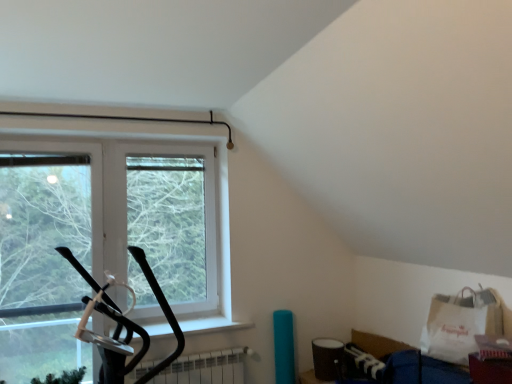
Question: From the image's perspective, is white paper grocery bag at lower right on top of white matte radiator at lower center?

Choices:
 (A) yes
 (B) no

Answer: (A)

Question: From a real-world perspective, is white paper grocery bag at lower right located higher than white matte radiator at lower center?

Choices:
 (A) yes
 (B) no

Answer: (A)

Question: Is the depth of white paper grocery bag at lower right greater than that of white matte radiator at lower center?

Choices:
 (A) yes
 (B) no

Answer: (B)

Question: Is white matte radiator at lower center a part of white paper grocery bag at lower right?

Choices:
 (A) yes
 (B) no

Answer: (B)

Question: Can you confirm if white paper grocery bag at lower right is smaller than white matte radiator at lower center?

Choices:
 (A) yes
 (B) no

Answer: (B)

Question: Does white paper grocery bag at lower right have a greater height compared to white matte radiator at lower center?

Choices:
 (A) no
 (B) yes

Answer: (B)

Question: Can you confirm if clear glass window at center is thinner than white matte radiator at lower center?

Choices:
 (A) yes
 (B) no

Answer: (A)

Question: Can white matte radiator at lower center be found inside clear glass window at center?

Choices:
 (A) yes
 (B) no

Answer: (B)

Question: Is clear glass window at center outside of white matte radiator at lower center?

Choices:
 (A) yes
 (B) no

Answer: (A)

Question: From a real-world perspective, is clear glass window at center on top of white matte radiator at lower center?

Choices:
 (A) yes
 (B) no

Answer: (A)

Question: Is clear glass window at center bigger than white matte radiator at lower center?

Choices:
 (A) no
 (B) yes

Answer: (B)

Question: Does clear glass window at center turn towards white matte radiator at lower center?

Choices:
 (A) no
 (B) yes

Answer: (A)

Question: Is clear glass window at center facing towards white paper grocery bag at lower right?

Choices:
 (A) no
 (B) yes

Answer: (A)